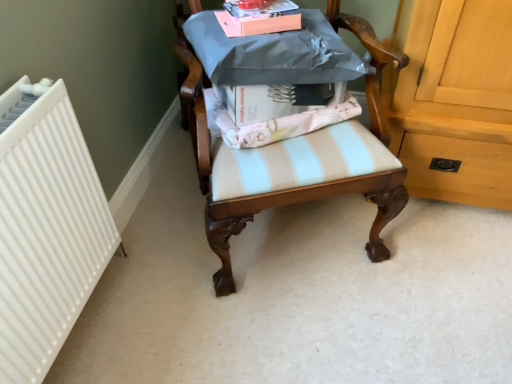
I want to click on vacant area on top of pink matte box at upper center (from a real-world perspective), so click(x=267, y=6).